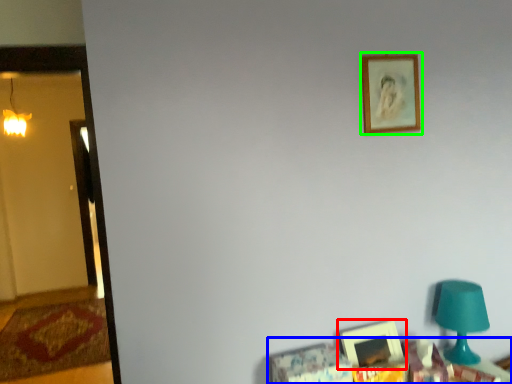
Question: Based on their relative distances, which object is farther from picture frame (highlighted by a red box)? Choose from furniture (highlighted by a blue box) and picture frame (highlighted by a green box).

Choices:
 (A) furniture
 (B) picture frame

Answer: (B)